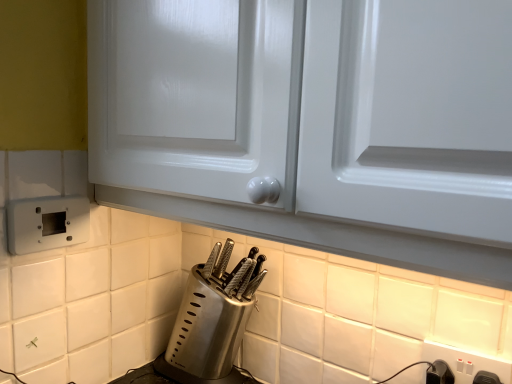
Question: Could you tell me if white plastic electric outlet at lower right, acting as the 2th electric outlet starting from the left, is facing satin silver knife block at lower center?

Choices:
 (A) no
 (B) yes

Answer: (A)

Question: Is white plastic electric outlet at lower right, placed as the first electric outlet when sorted from right to left, far away from satin silver knife block at lower center?

Choices:
 (A) yes
 (B) no

Answer: (B)

Question: Is white plastic electric outlet at lower right, acting as the 2th electric outlet starting from the left, to the right of satin silver knife block at lower center from the viewer's perspective?

Choices:
 (A) yes
 (B) no

Answer: (A)

Question: Is white plastic electric outlet at lower right, placed as the first electric outlet when sorted from right to left, turned away from satin silver knife block at lower center?

Choices:
 (A) no
 (B) yes

Answer: (A)

Question: Considering the relative positions of white plastic electric outlet at lower right, acting as the 2th electric outlet starting from the left, and satin silver knife block at lower center in the image provided, is white plastic electric outlet at lower right, acting as the 2th electric outlet starting from the left, in front of satin silver knife block at lower center?

Choices:
 (A) no
 (B) yes

Answer: (B)

Question: In terms of height, does black plastic switch at lower right look taller or shorter compared to white plastic electric outlet at lower left, the second electric outlet when ordered from bottom to top?

Choices:
 (A) short
 (B) tall

Answer: (A)

Question: In the image, is black plastic switch at lower right on the left side or the right side of white plastic electric outlet at lower left, which appears as the first electric outlet when viewed from the left?

Choices:
 (A) left
 (B) right

Answer: (B)

Question: Looking at the image, does black plastic switch at lower right seem bigger or smaller compared to white plastic electric outlet at lower left, the second electric outlet in the right-to-left sequence?

Choices:
 (A) small
 (B) big

Answer: (A)

Question: Does point (430, 372) appear closer or farther from the camera than point (35, 216)?

Choices:
 (A) farther
 (B) closer

Answer: (B)

Question: Would you say white plastic electric outlet at lower right, placed as the first electric outlet when sorted from right to left, is inside or outside satin silver knife block at lower center?

Choices:
 (A) outside
 (B) inside

Answer: (A)

Question: Is white plastic electric outlet at lower right, the first electric outlet ordered from the bottom, to the left or to the right of satin silver knife block at lower center in the image?

Choices:
 (A) right
 (B) left

Answer: (A)

Question: Considering their positions, is white plastic electric outlet at lower right, the first electric outlet ordered from the bottom, located in front of or behind satin silver knife block at lower center?

Choices:
 (A) front
 (B) behind

Answer: (A)

Question: From a real-world perspective, is white plastic electric outlet at lower right, the first electric outlet ordered from the bottom, positioned above or below satin silver knife block at lower center?

Choices:
 (A) above
 (B) below

Answer: (A)

Question: Considering the positions of white plastic electric outlet at lower left, the 1th electric outlet when ordered from top to bottom, and black plastic switch at lower right in the image, is white plastic electric outlet at lower left, the 1th electric outlet when ordered from top to bottom, wider or thinner than black plastic switch at lower right?

Choices:
 (A) wide
 (B) thin

Answer: (B)

Question: Is white plastic electric outlet at lower left, which appears as the first electric outlet when viewed from the left, in front of or behind black plastic switch at lower right in the image?

Choices:
 (A) front
 (B) behind

Answer: (B)